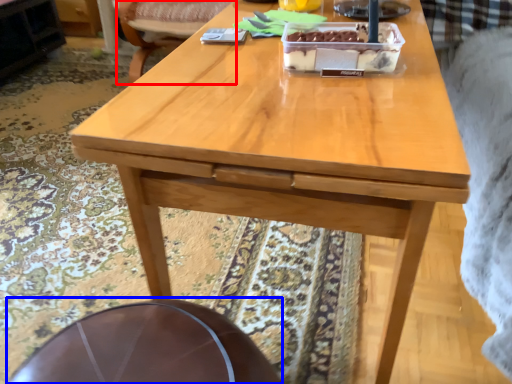
Question: Which object is further to the camera taking this photo, chair (highlighted by a red box) or round table (highlighted by a blue box)?

Choices:
 (A) chair
 (B) round table

Answer: (A)